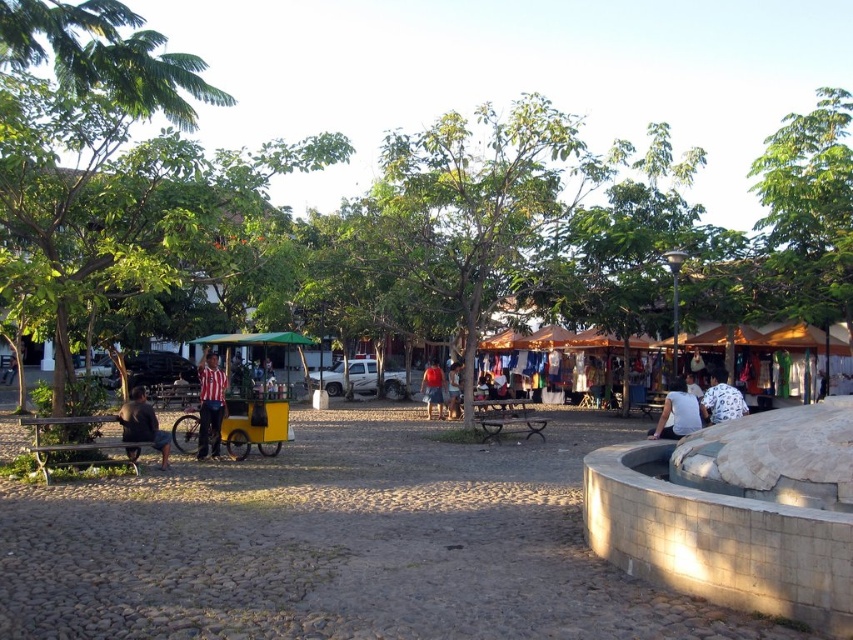
You are a photographer standing at the center of the plaza. You want to take a photo of the striped fabric shirt at center. Where should you point your camera to capture it?

The striped fabric shirt at center is located at point 0.633 on the x axis and 0.247 on the y axis, so you should point your camera towards those coordinates to capture it.

In the scene shown: You are a tailor who needs to determine which shirt to recommend to a customer who prefers lightweight clothing. Based on the scene, which of the two shirts, the dark gray fabric shirt at lower left or the white cotton shirt at lower right, is lighter in weight?

The dark gray fabric shirt at lower left is thinner than the white cotton shirt at lower right, so it is lighter in weight and would be the better recommendation for lightweight clothing.

You are standing in the market and want to reach the two points marked in the image. Which point, point (134, 448) or point (685, 392), is closer to you?

Point (134, 448) is closer to you because it is further to the viewer than point (685, 392).